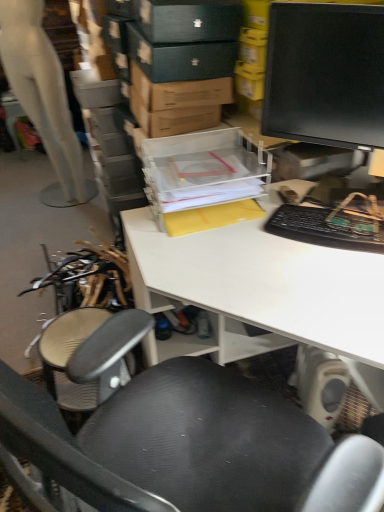
Question: Could you tell me if black plastic keyboard at right is turned towards black textured chair at center?

Choices:
 (A) no
 (B) yes

Answer: (B)

Question: Is black plastic keyboard at right turned away from black textured chair at center?

Choices:
 (A) yes
 (B) no

Answer: (B)

Question: Can you confirm if black plastic keyboard at right is bigger than black textured chair at center?

Choices:
 (A) no
 (B) yes

Answer: (A)

Question: Can you confirm if black plastic keyboard at right is wider than black textured chair at center?

Choices:
 (A) yes
 (B) no

Answer: (B)

Question: Are black plastic keyboard at right and black textured chair at center beside each other?

Choices:
 (A) yes
 (B) no

Answer: (B)

Question: Can you confirm if black plastic keyboard at right is taller than black textured chair at center?

Choices:
 (A) no
 (B) yes

Answer: (A)

Question: Considering the relative positions of white matte desk at center and black plastic keyboard at right in the image provided, is white matte desk at center to the right of black plastic keyboard at right from the viewer's perspective?

Choices:
 (A) yes
 (B) no

Answer: (B)

Question: From a real-world perspective, is white matte desk at center under black plastic keyboard at right?

Choices:
 (A) yes
 (B) no

Answer: (A)

Question: Is white matte desk at center placed right next to black plastic keyboard at right?

Choices:
 (A) no
 (B) yes

Answer: (A)

Question: Is black plastic keyboard at right at the back of white matte desk at center?

Choices:
 (A) no
 (B) yes

Answer: (A)

Question: Can you confirm if white matte desk at center is smaller than black plastic keyboard at right?

Choices:
 (A) yes
 (B) no

Answer: (B)

Question: Considering the relative sizes of white matte desk at center and black plastic keyboard at right in the image provided, is white matte desk at center shorter than black plastic keyboard at right?

Choices:
 (A) yes
 (B) no

Answer: (B)

Question: Is transparent plastic storage box at center not near matte black monitor at upper right?

Choices:
 (A) yes
 (B) no

Answer: (B)